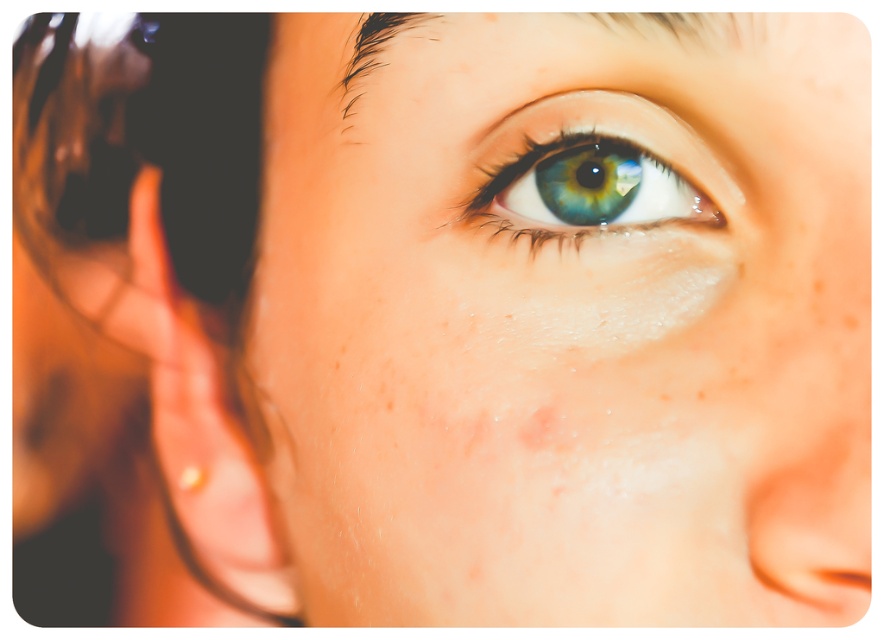
Question: Is smooth skin eye at center positioned at the back of pale skin freckle at center?

Choices:
 (A) no
 (B) yes

Answer: (A)

Question: Does smooth skin eye at center appear on the right side of green glossy eye at center?

Choices:
 (A) yes
 (B) no

Answer: (B)

Question: Which of the following is the closest to the observer?

Choices:
 (A) green glossy eye at center
 (B) pale skin freckle at center
 (C) gold metallic earring at lower left

Answer: (A)

Question: Considering the real-world distances, which object is closest to the smooth skin eye at center?

Choices:
 (A) pale skin freckle at center
 (B) green glossy eye at center
 (C) gold metallic earring at lower left

Answer: (B)

Question: Is smooth skin eye at center behind gold metallic earring at lower left?

Choices:
 (A) yes
 (B) no

Answer: (B)

Question: Which object is positioned farthest from the smooth skin eye at center?

Choices:
 (A) pale skin freckle at center
 (B) green glossy eye at center

Answer: (A)